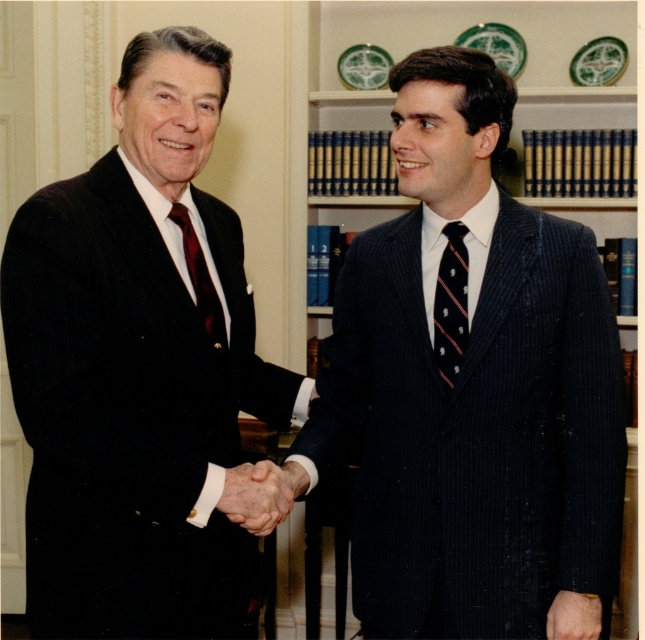
You are an event planner organizing a formal event and need to ensure proper attire coordination between two guests. The guests are wearing a pinstriped suit at center and a matte dark red tie at left. Based on their positions in the image, which guest is standing lower in the frame?

The pinstriped suit at center is located below matte dark red tie at left, so the guest wearing the pinstriped suit at center is standing lower in the frame.

What is the coordinate of the pinstriped suit at center?

The pinstriped suit at center is located at coordinate point (470, 385).

You are a photographer trying to capture the handshake between the two men in the scene. The matte dark red tie at left is represented by point (201, 276). To ensure the tie is visible in the photo, where should you position the camera relative to the two men?

The matte dark red tie at left is located at point (201, 276), so the camera should be positioned to the left side of the two men to ensure the tie is visible in the photo.